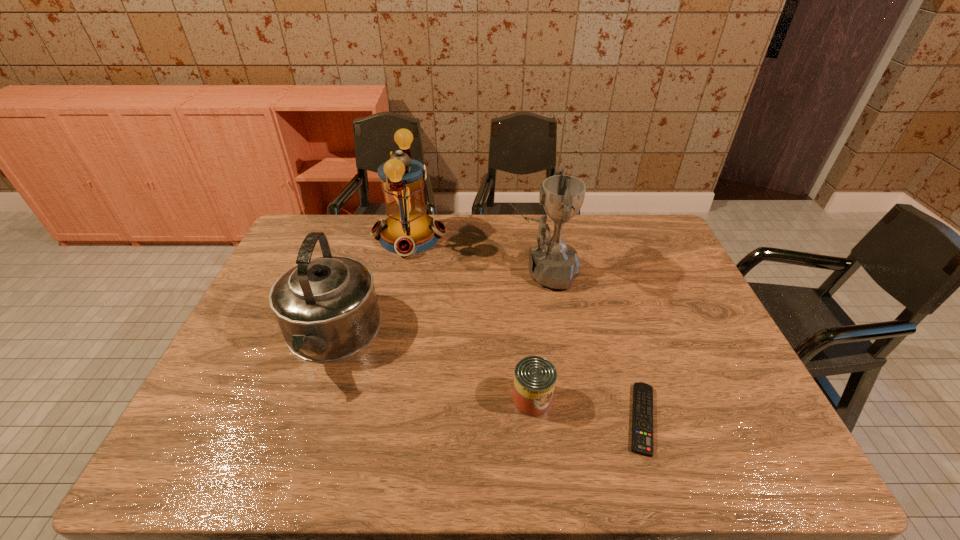
The width and height of the screenshot is (960, 540). I want to click on free spot located 0.090m with the spout at the front of the kettle, so click(301, 423).

The width and height of the screenshot is (960, 540). I want to click on blank area located 0.150m on the back of the can, so click(x=526, y=336).

The width and height of the screenshot is (960, 540). In order to click on vacant region located on the right of the remote control in this screenshot , I will do `click(765, 418)`.

This screenshot has width=960, height=540. I want to click on lantern present at the far edge, so click(407, 230).

Locate an element on the screen. The image size is (960, 540). award that is at the far edge is located at coordinates (553, 263).

I want to click on object that is at the near edge, so click(642, 416).

Where is `object at the left edge`? object at the left edge is located at coordinates (326, 307).

This screenshot has width=960, height=540. Identify the location of vacant space at the far edge of the desktop. (506, 248).

In the image, there is a desktop. Where is `vacant space at the near edge`? vacant space at the near edge is located at coordinates [x=481, y=450].

I want to click on free space at the left edge of the desktop, so click(x=228, y=387).